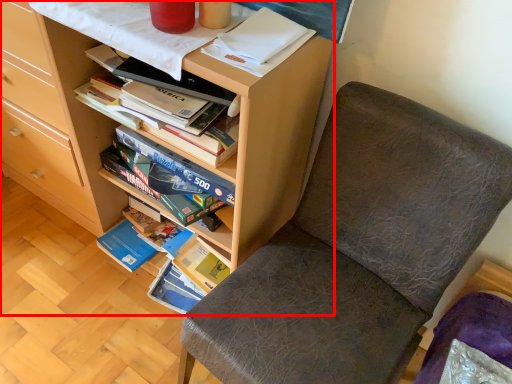
Question: From the image, what is the correct spatial relationship of bookcase (annotated by the red box) in relation to chair?

Choices:
 (A) right
 (B) left

Answer: (B)